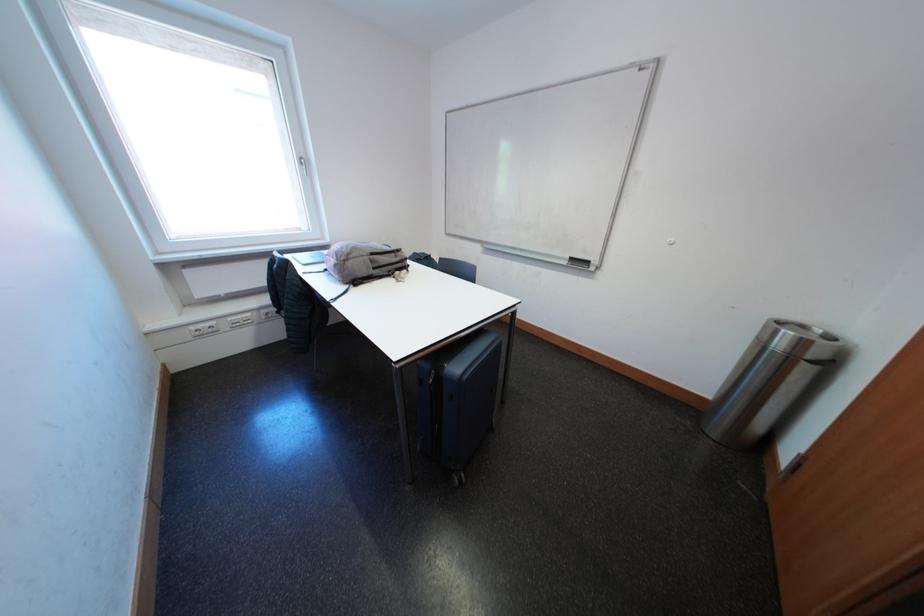
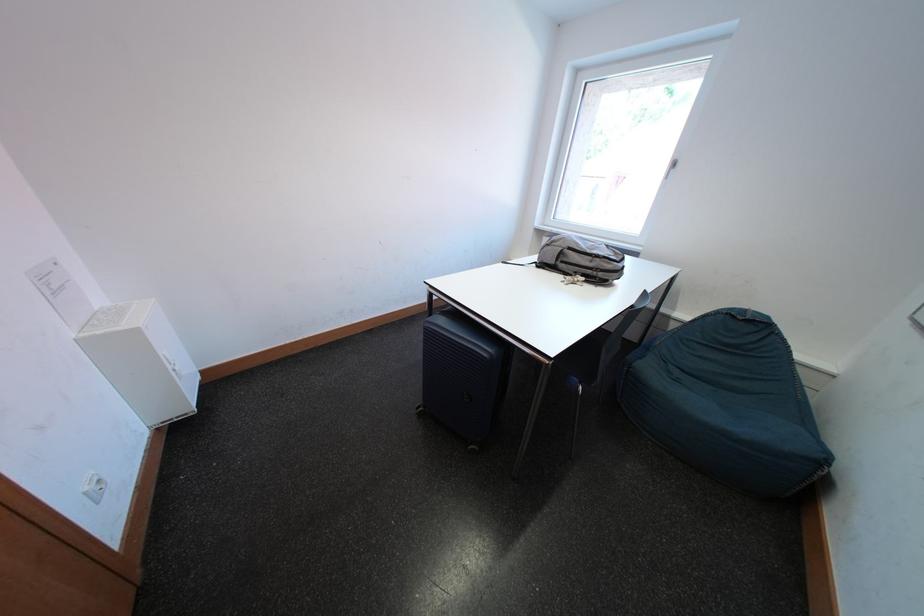
Where in the second image is the point corresponding to point 406,261 from the first image?

(601, 265)